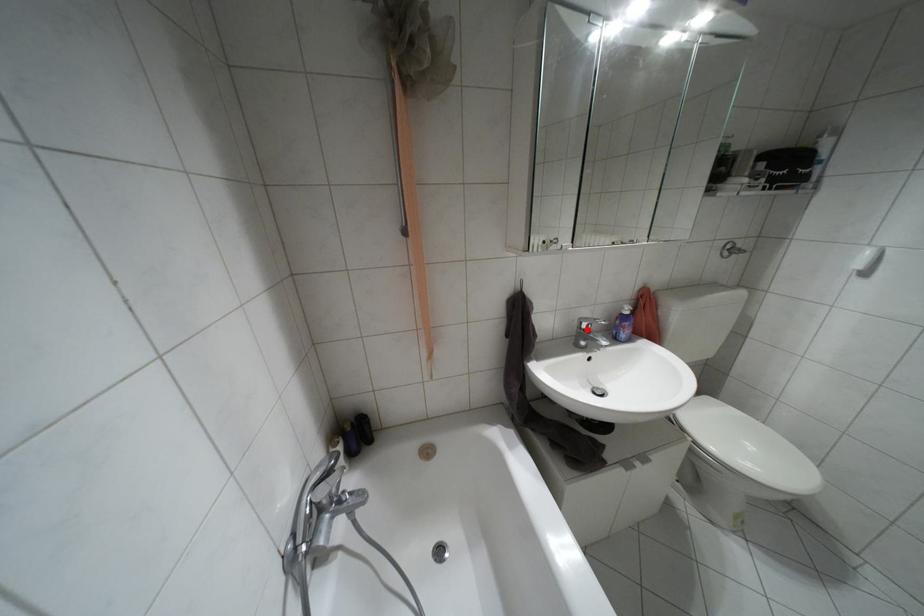
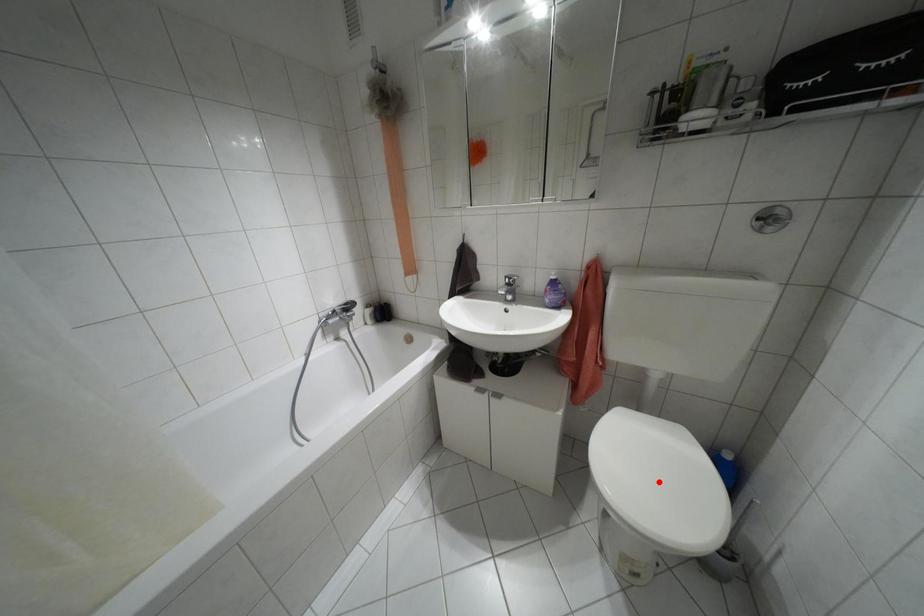
I am providing you with two images of the same scene from different viewpoints. A red point is marked on the first image and another point is marked on the second image. Is the red point in image1 aligned with the point shown in image2?

No